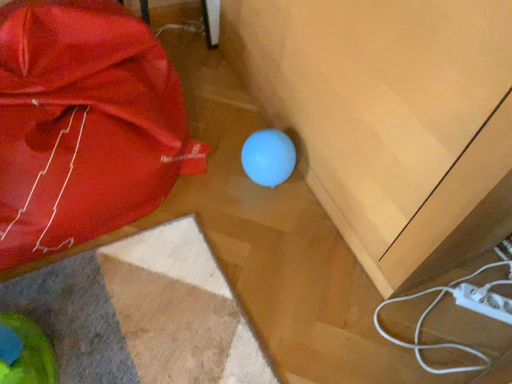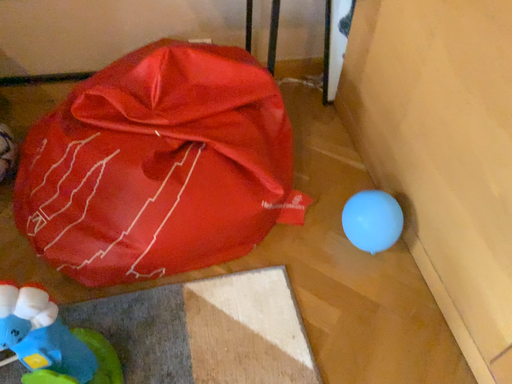
Question: How did the camera likely rotate when shooting the video?

Choices:
 (A) rotated downward
 (B) rotated upward

Answer: (B)